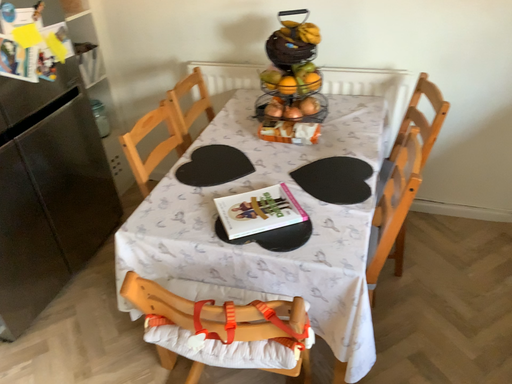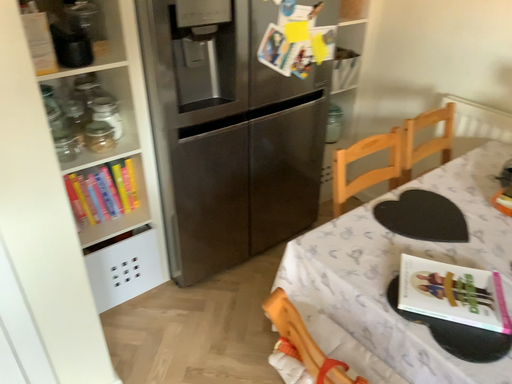
Question: Which way did the camera rotate in the video?

Choices:
 (A) rotated right
 (B) rotated left

Answer: (B)